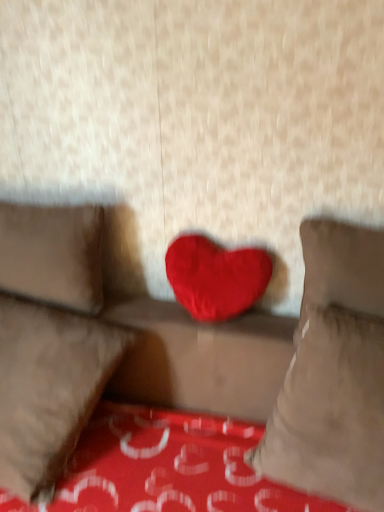
Question: Is red plush heart at center not inside velvet red heart at center?

Choices:
 (A) no
 (B) yes

Answer: (B)

Question: From the image's perspective, is red plush heart at center beneath velvet red heart at center?

Choices:
 (A) yes
 (B) no

Answer: (B)

Question: Is red plush heart at center turned away from velvet red heart at center?

Choices:
 (A) yes
 (B) no

Answer: (B)

Question: From a real-world perspective, is red plush heart at center located beneath velvet red heart at center?

Choices:
 (A) no
 (B) yes

Answer: (A)

Question: Is the depth of red plush heart at center greater than that of velvet red heart at center?

Choices:
 (A) yes
 (B) no

Answer: (A)

Question: From the image's perspective, is red plush heart at center located above or below velvet red heart at center, which is the 2th pillow from right to left?

Choices:
 (A) above
 (B) below

Answer: (A)

Question: In terms of width, does red plush heart at center look wider or thinner when compared to velvet red heart at center, which is the 2th pillow from right to left?

Choices:
 (A) wide
 (B) thin

Answer: (B)

Question: Is red plush heart at center spatially inside velvet red heart at center, which is the 2th pillow from left to right, or outside of it?

Choices:
 (A) outside
 (B) inside

Answer: (A)

Question: Considering the relative positions of red plush heart at center and velvet red heart at center, which is the 2th pillow from left to right, in the image provided, is red plush heart at center to the left or to the right of velvet red heart at center, which is the 2th pillow from left to right,?

Choices:
 (A) right
 (B) left

Answer: (A)

Question: From a real-world perspective, is velvet red heart at center, which is the 2th pillow from right to left, positioned above or below suede-like beige pillow at left, the first pillow in the left-to-right sequence?

Choices:
 (A) below
 (B) above

Answer: (A)

Question: Looking at the image, does velvet red heart at center, which is the 2th pillow from left to right, seem bigger or smaller compared to suede-like beige pillow at left, placed as the third pillow when sorted from right to left?

Choices:
 (A) small
 (B) big

Answer: (B)

Question: From the image's perspective, is velvet red heart at center, which is the 2th pillow from left to right, above or below suede-like beige pillow at left, placed as the third pillow when sorted from right to left?

Choices:
 (A) above
 (B) below

Answer: (B)

Question: Is velvet red heart at center, which is the 2th pillow from right to left, inside or outside of suede-like beige pillow at left, the first pillow in the left-to-right sequence?

Choices:
 (A) inside
 (B) outside

Answer: (B)

Question: Is velvet red heart at center, positioned as the third pillow in left-to-right order, bigger or smaller than red plush heart at center?

Choices:
 (A) big
 (B) small

Answer: (A)

Question: From a real-world perspective, is velvet red heart at center, marked as the first pillow in a right-to-left arrangement, positioned above or below red plush heart at center?

Choices:
 (A) above
 (B) below

Answer: (B)